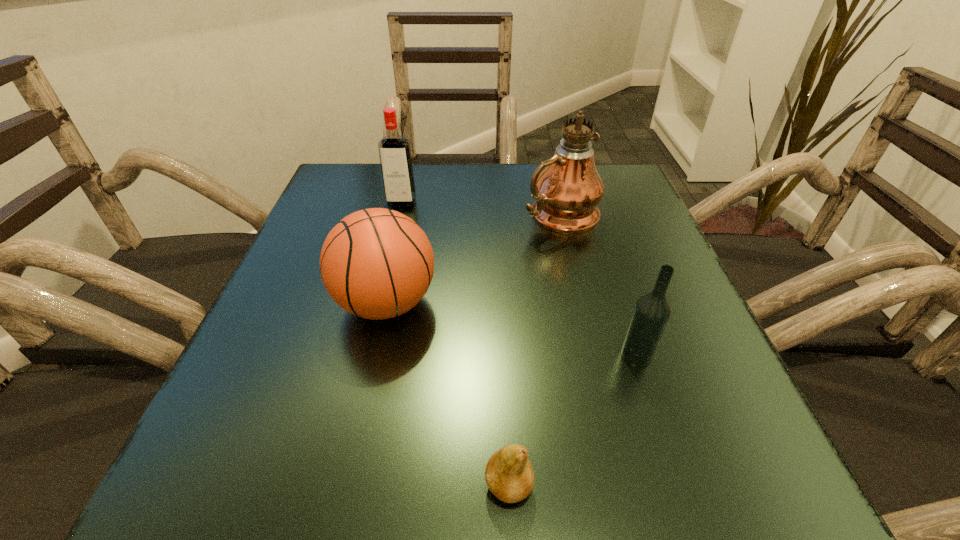
You are a GUI agent. You are given a task and a screenshot of the screen. Output one action in this format:
    pyautogui.click(x=<x>, y=<y>)
    Task: Click on the vacant space located 0.390m on the back of the basketball
    This screenshot has width=960, height=540.
    Given the screenshot: What is the action you would take?
    pyautogui.click(x=416, y=168)

Identify the location of vacant space positioned on the left of the shorter vodka. The height and width of the screenshot is (540, 960). (379, 355).

Find the location of a particular element. free region located on the back of the nearest object is located at coordinates (498, 261).

At what (x,y) coordinates should I click in order to perform the action: click on oil lamp that is at the far edge. Please return your answer as a coordinate pair (x, y). Looking at the image, I should click on (567, 192).

At what (x,y) coordinates should I click in order to perform the action: click on vodka situated at the far edge. Please return your answer as a coordinate pair (x, y). Looking at the image, I should click on (394, 150).

Find the location of a particular element. This screenshot has height=540, width=960. object present at the near edge is located at coordinates (509, 475).

The width and height of the screenshot is (960, 540). I want to click on vodka present at the left edge, so click(394, 150).

Image resolution: width=960 pixels, height=540 pixels. I want to click on basketball that is at the left edge, so click(x=376, y=263).

Identify the location of oil lamp present at the right edge. This screenshot has width=960, height=540. (567, 192).

This screenshot has width=960, height=540. What are the coordinates of `vodka positioned at the right edge` in the screenshot? It's located at (652, 311).